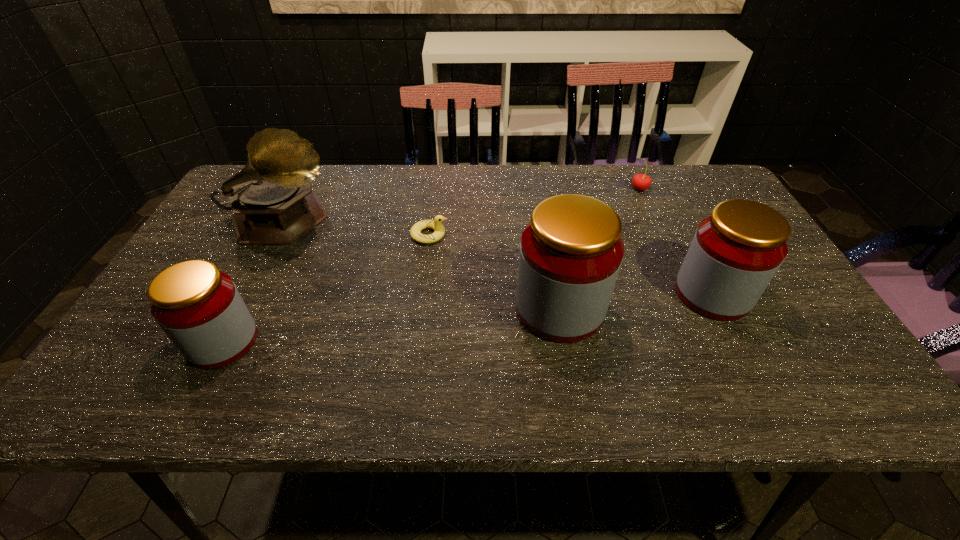
This screenshot has height=540, width=960. What are the coordinates of `object positioned at the far left corner` in the screenshot? It's located at (272, 201).

The width and height of the screenshot is (960, 540). Identify the location of object that is at the near left corner. (199, 308).

Where is `vacant space at the far edge of the desktop`? The height and width of the screenshot is (540, 960). vacant space at the far edge of the desktop is located at coordinates (525, 192).

Locate an element on the screen. Image resolution: width=960 pixels, height=540 pixels. vacant space at the near edge of the desktop is located at coordinates (688, 359).

You are a GUI agent. You are given a task and a screenshot of the screen. Output one action in this format:
    pyautogui.click(x=<x>, y=<y>)
    Task: Click on the vacant region at the left edge of the desktop
    The width and height of the screenshot is (960, 540).
    Given the screenshot: What is the action you would take?
    pyautogui.click(x=218, y=231)

Image resolution: width=960 pixels, height=540 pixels. Identify the location of vacant area at the right edge. (823, 327).

Locate an element on the screen. This screenshot has width=960, height=540. blank space at the far right corner is located at coordinates (681, 164).

The image size is (960, 540). Identify the location of blank area at the near right corner. (803, 359).

The height and width of the screenshot is (540, 960). I want to click on free space between the rightmost jar and the phonograph record, so click(498, 258).

Image resolution: width=960 pixels, height=540 pixels. Find the location of `free space between the fifth tallest object and the fourth tallest object`. free space between the fifth tallest object and the fourth tallest object is located at coordinates (431, 265).